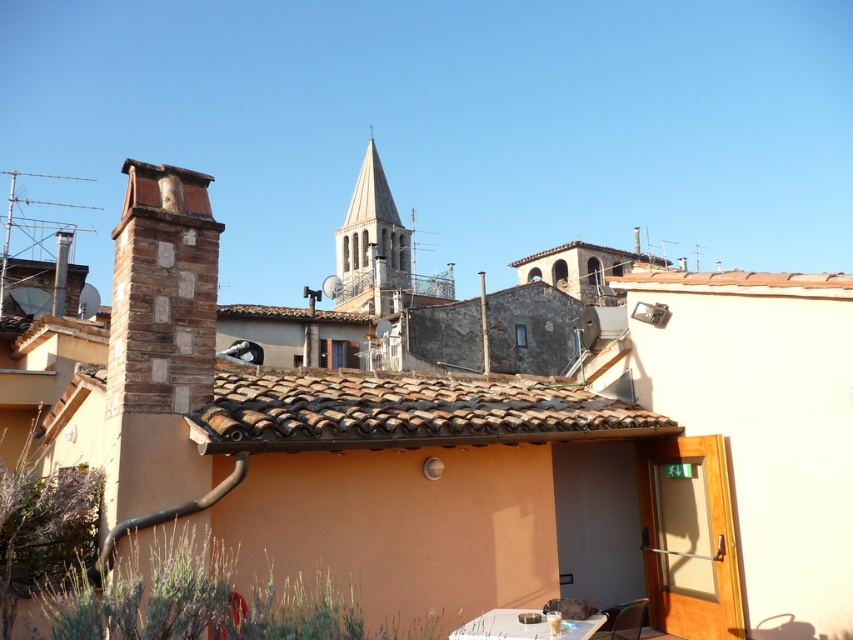
Question: Which object is the closest to the brown clay tiles at center?

Choices:
 (A) metallic silver chair at lower right
 (B) white glossy table at lower center
 (C) brown stone chimney at left

Answer: (B)

Question: Which point appears farthest from the camera in this image?

Choices:
 (A) (712, 276)
 (B) (575, 620)

Answer: (A)

Question: Can you confirm if brown clay tiles at center is smaller than metallic silver chair at lower right?

Choices:
 (A) no
 (B) yes

Answer: (A)

Question: Does brown stone chimney at left appear on the left side of brown tile roof at upper center?

Choices:
 (A) no
 (B) yes

Answer: (B)

Question: Which point is farther from the camera taking this photo?

Choices:
 (A) (357, 198)
 (B) (299, 426)

Answer: (A)

Question: Does brown clay tiles at center appear on the right side of brown stone chimney at left?

Choices:
 (A) no
 (B) yes

Answer: (B)